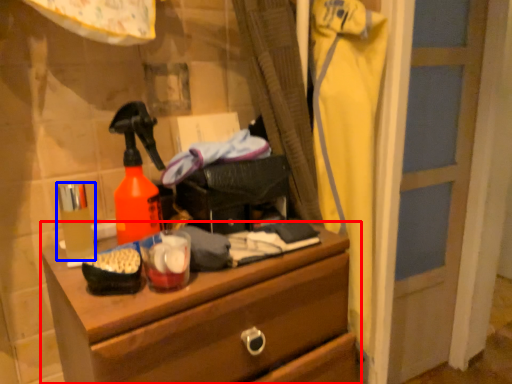
Question: Which point is further to the camera, chest of drawers (highlighted by a red box) or toiletry (highlighted by a blue box)?

Choices:
 (A) chest of drawers
 (B) toiletry

Answer: (B)